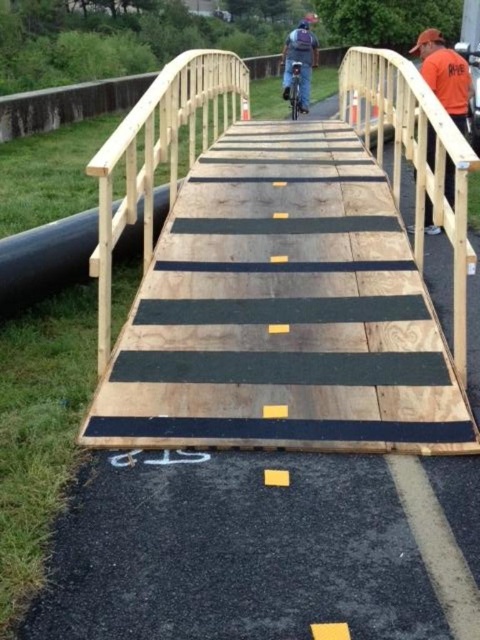
You are standing on the wooden bridge and looking towards the construction site. Which clothing item, the orange cotton shirt at upper right or the denim jacket at center, is nearer to you?

The orange cotton shirt at upper right is closer to the viewer than the denim jacket at center, so it is nearer to you.